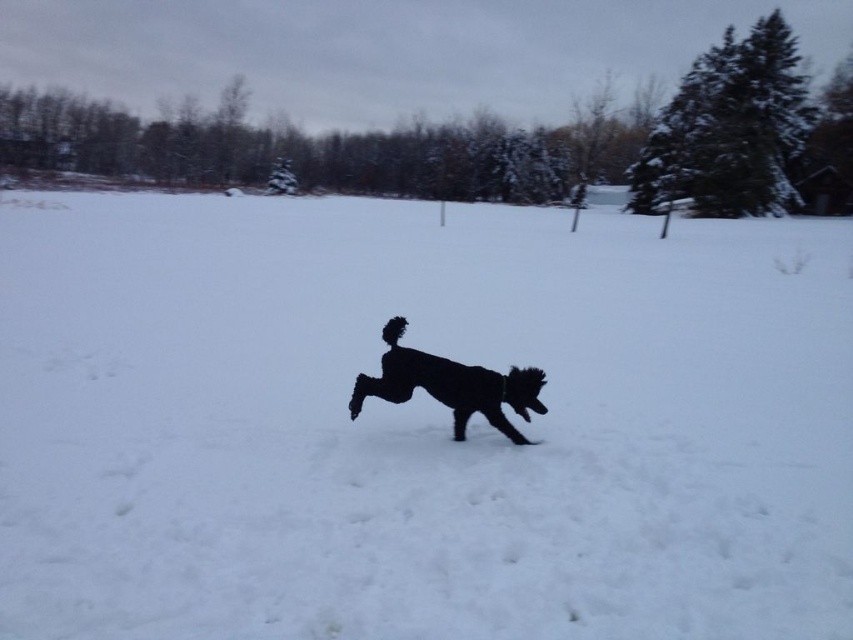
Question: Considering the relative positions of white fluffy snow at center and black fluffy dog at center in the image provided, where is white fluffy snow at center located with respect to black fluffy dog at center?

Choices:
 (A) below
 (B) above

Answer: (B)

Question: Which point appears farthest from the camera in this image?

Choices:
 (A) (438, 396)
 (B) (636, 378)

Answer: (B)

Question: Among these objects, which one is nearest to the camera?

Choices:
 (A) black fluffy dog at center
 (B) white fluffy snow at center

Answer: (B)

Question: Which of the following is the closest to the observer?

Choices:
 (A) black fluffy dog at center
 (B) white fluffy snow at center

Answer: (B)

Question: Can you confirm if white fluffy snow at center is wider than black fluffy dog at center?

Choices:
 (A) no
 (B) yes

Answer: (B)

Question: Is white fluffy snow at center bigger than black fluffy dog at center?

Choices:
 (A) no
 (B) yes

Answer: (B)